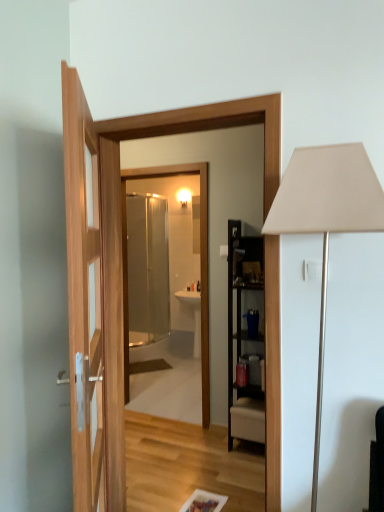
Question: From the image's perspective, is transparent glass mirror at center positioned above or below clear glass shower door at center?

Choices:
 (A) below
 (B) above

Answer: (A)

Question: Based on their positions, is transparent glass mirror at center located to the left or right of clear glass shower door at center?

Choices:
 (A) right
 (B) left

Answer: (A)

Question: Estimate the real-world distances between objects in this image. Which object is farther from the transparent glass mirror at center?

Choices:
 (A) white matte table lamp at right
 (B) clear glass shower door at center

Answer: (B)

Question: Which object is the closest to the transparent glass mirror at center?

Choices:
 (A) clear glass shower door at center
 (B) white matte table lamp at right

Answer: (B)